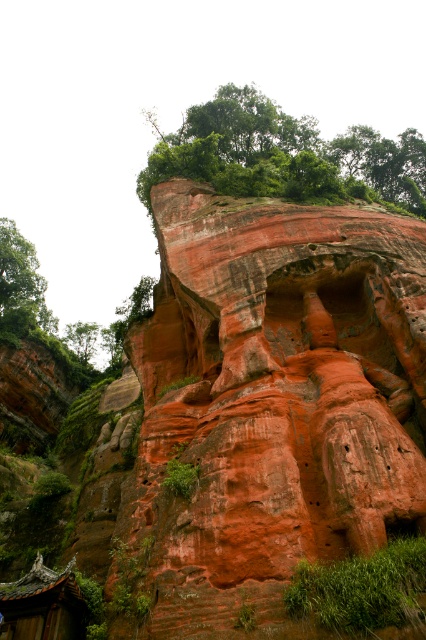
Is wooden tiled roof hut at lower left below green leafy tree at left?

Indeed, wooden tiled roof hut at lower left is positioned under green leafy tree at left.

Between wooden tiled roof hut at lower left and green leafy tree at left, which one is positioned higher?

green leafy tree at left

Is point (51, 588) behind point (55, 321)?

No.

The image size is (426, 640). I want to click on wooden tiled roof hut at lower left, so click(x=42, y=604).

Between point (353, 228) and point (302, 580), which one is positioned behind?

Positioned behind is point (353, 228).

Is point (310, 380) less distant than point (402, 611)?

No, (310, 380) is further to viewer.

At what (x,y) coordinates should I click in order to perform the action: click on reddish-brown stone carving at upper center. Please return your answer as a coordinate pair (x, y). Looking at the image, I should click on (271, 401).

Which of these two, green leafy tree at upper center or wooden tiled roof hut at lower left, stands shorter?

Standing shorter between the two is wooden tiled roof hut at lower left.

Which is above, green leafy tree at upper center or wooden tiled roof hut at lower left?

green leafy tree at upper center is higher up.

At what (x,y) coordinates should I click in order to perform the action: click on green leafy tree at upper center. Please return your answer as a coordinate pair (x, y). Looking at the image, I should click on (284, 156).